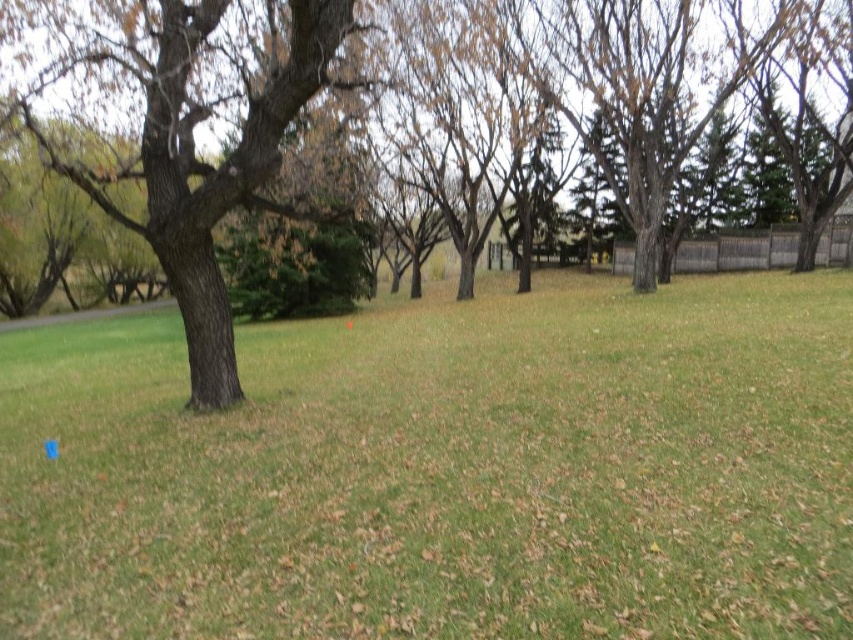
Question: Which object is farther from the camera taking this photo?

Choices:
 (A) smooth brown tree at left
 (B) brown rough tree at left

Answer: (B)

Question: Can you confirm if brown rough tree at left is positioned above smooth brown tree at left?

Choices:
 (A) yes
 (B) no

Answer: (A)

Question: Does brown rough tree at left have a lesser width compared to smooth brown tree at left?

Choices:
 (A) no
 (B) yes

Answer: (A)

Question: Which point is closer to the camera taking this photo?

Choices:
 (A) (242, 179)
 (B) (163, 244)

Answer: (A)

Question: Can you confirm if brown rough tree at left is positioned to the left of smooth brown tree at left?

Choices:
 (A) no
 (B) yes

Answer: (B)